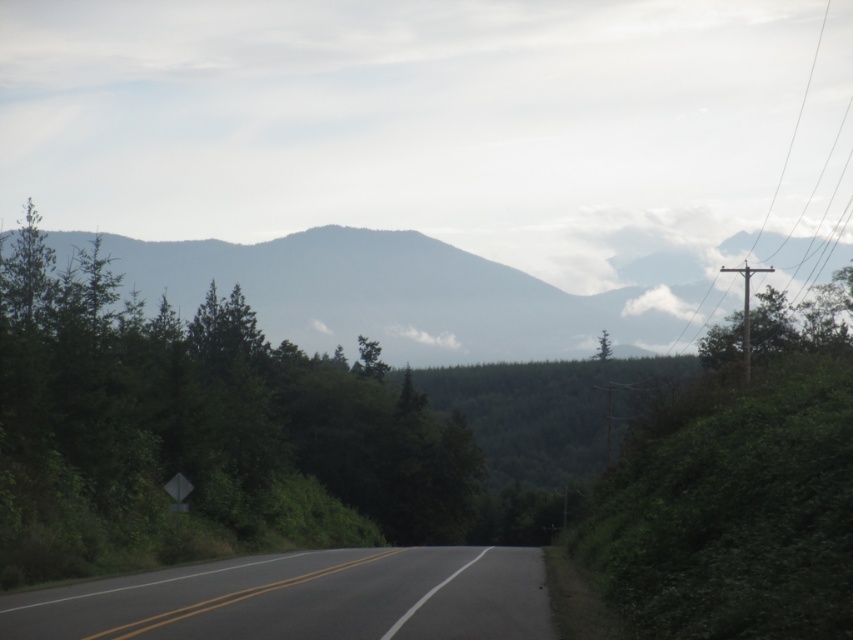
Question: Can you confirm if green leafy tree at center is bigger than black asphalt road at center?

Choices:
 (A) no
 (B) yes

Answer: (B)

Question: Which object is closer to the camera taking this photo?

Choices:
 (A) green leafy tree at center
 (B) gray foggy mountain at center
 (C) black asphalt road at center

Answer: (C)

Question: Does green leafy tree at center appear over gray foggy mountain at center?

Choices:
 (A) yes
 (B) no

Answer: (A)

Question: Among these objects, which one is nearest to the camera?

Choices:
 (A) black asphalt road at center
 (B) green leafy tree at center
 (C) gray foggy mountain at center

Answer: (A)

Question: Is gray foggy mountain at center above black asphalt road at center?

Choices:
 (A) no
 (B) yes

Answer: (B)

Question: Which object is the farthest from the gray foggy mountain at center?

Choices:
 (A) green leafy tree at center
 (B) black asphalt road at center

Answer: (B)